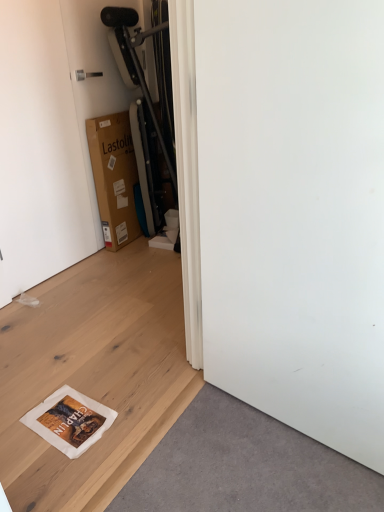
In order to click on vacant space to the right of white matte door at upper left in this screenshot , I will do `click(108, 270)`.